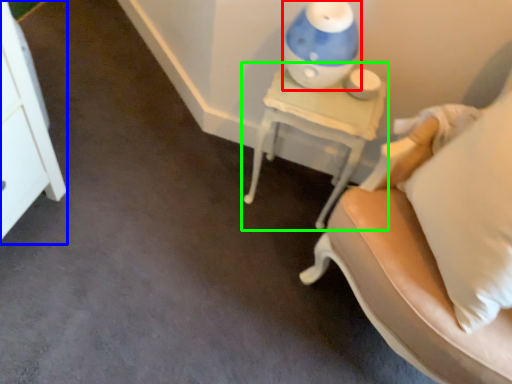
Question: Which object is positioned farthest from table lamp (highlighted by a red box)? Select from dresser (highlighted by a blue box) and nightstand (highlighted by a green box).

Choices:
 (A) dresser
 (B) nightstand

Answer: (A)